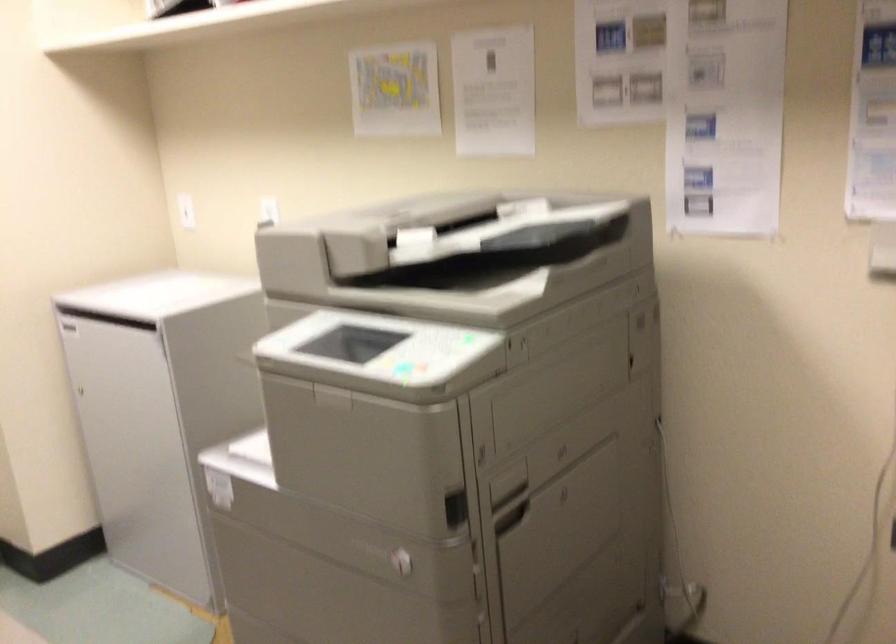
Where is `refrigerator door handle`? This screenshot has width=896, height=644. refrigerator door handle is located at coordinates (85, 392).